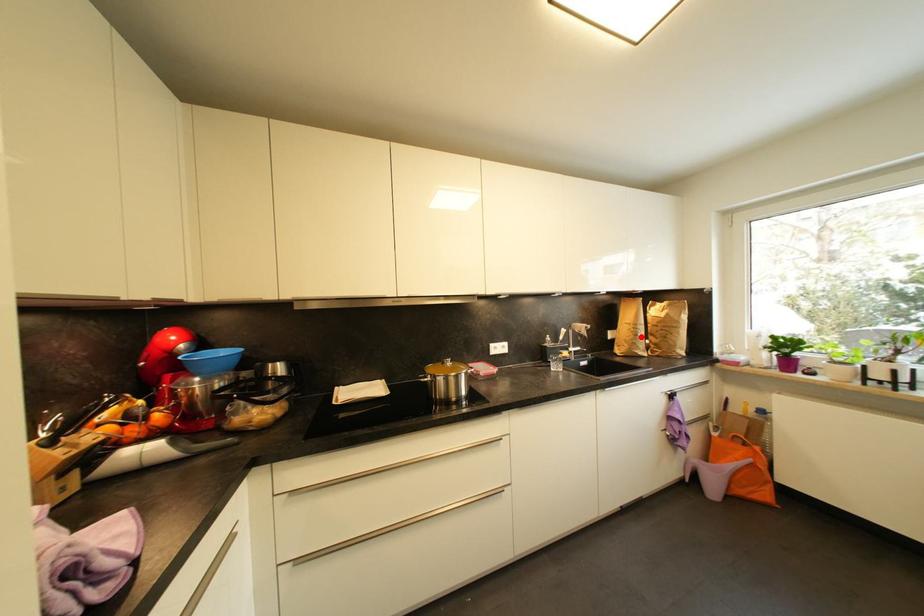
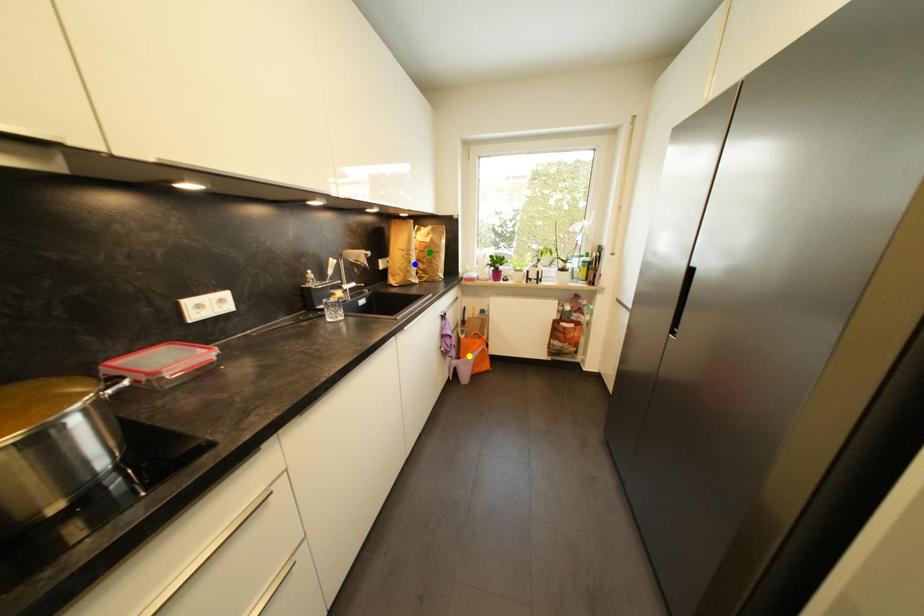
Question: I am providing you with two images of the same scene from different viewpoints. A red point is marked on the first image. You are given multiple points on the second image. Which spot in image 2 lines up with the point in image 1?

Choices:
 (A) yellow point
 (B) blue point
 (C) green point

Answer: (B)